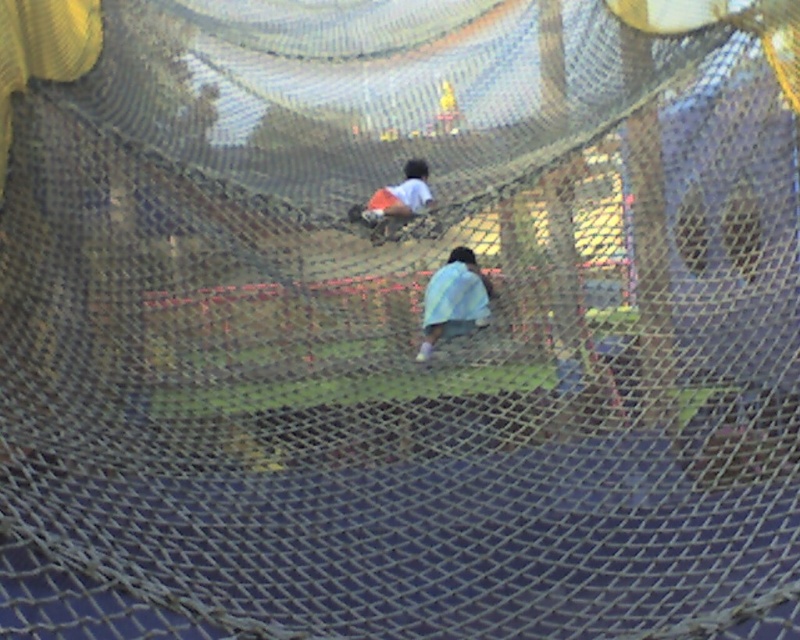
You are a parent observing your children playing in a netted playground area. You notice the light blue fabric at center and the orange shorts at center. Which child is higher up in the netting structure?

The light blue fabric at center is higher than the orange shorts at center, so the child wearing the light blue fabric at center is higher up in the netting structure.